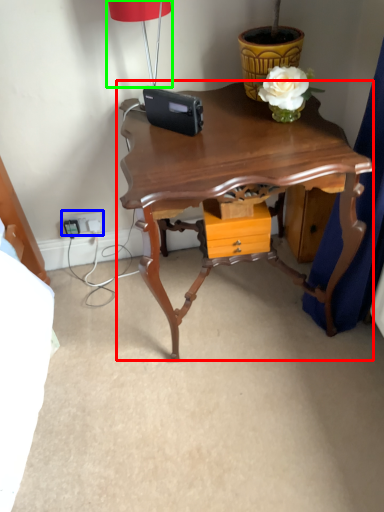
Question: Which object is positioned farthest from table (highlighted by a red box)? Select from electric outlet (highlighted by a blue box) and lamp (highlighted by a green box).

Choices:
 (A) electric outlet
 (B) lamp

Answer: (A)